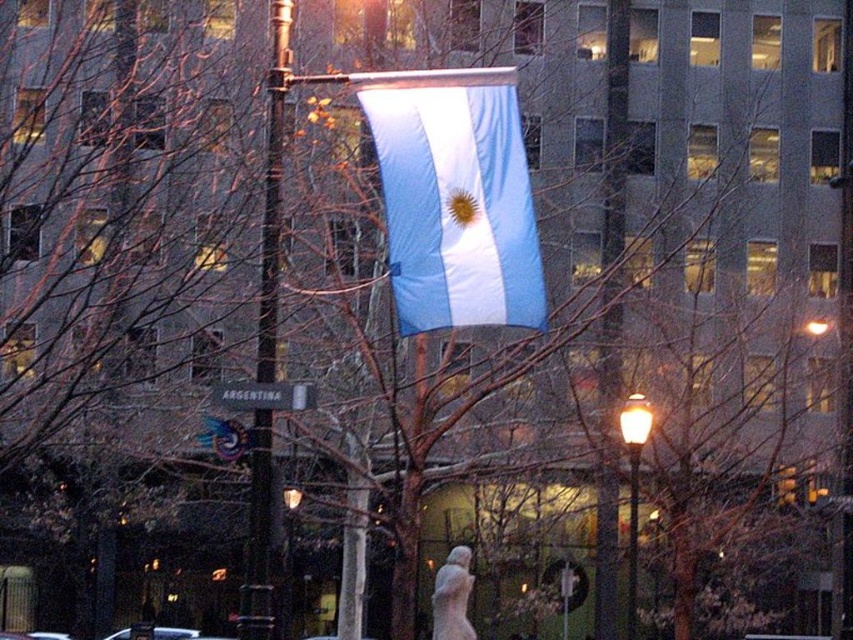
You are a delivery driver who needs to attach a small package to the white plastic street sign at center and the matte black lamp post at center. Which object can accommodate the package more comfortably?

The matte black lamp post at center has a larger size compared to the white plastic street sign at center, so it can accommodate the package more comfortably.

You are a city planner trying to install a new bench between the metallic pole at center and the matte black lamp post at center. The bench requires 1.5 meters of space to fit. Can the bench be placed between them?

The metallic pole at center and matte black lamp post at center are 13.11 meters apart, so yes, the bench requiring 1.5 meters of space can be placed between them since the distance between the two objects is sufficient.